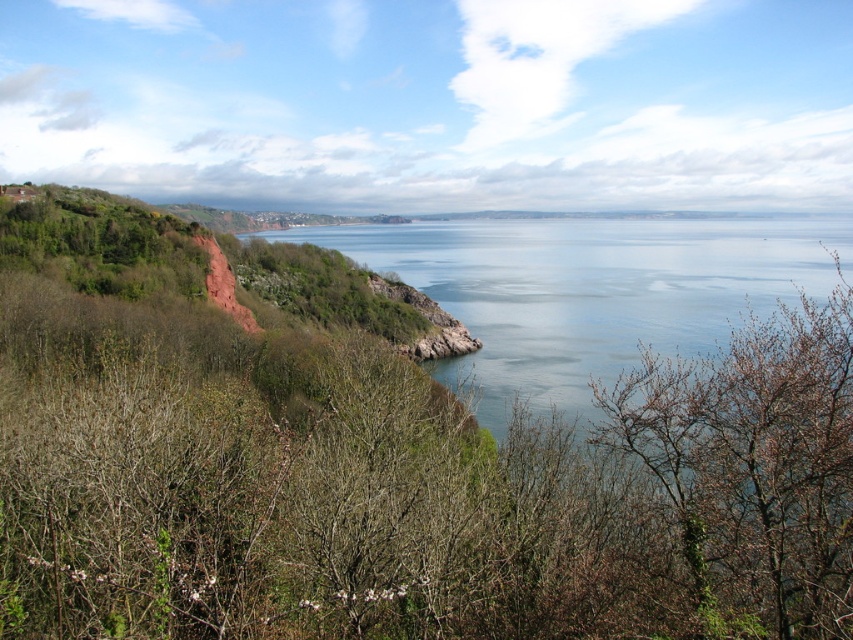
Question: Can you confirm if blue water at center is positioned below bare branches at center?

Choices:
 (A) no
 (B) yes

Answer: (A)

Question: Can you confirm if blue water at center is positioned above bare branches at center?

Choices:
 (A) yes
 (B) no

Answer: (A)

Question: Which of the following is the farthest from the observer?

Choices:
 (A) (763, 324)
 (B) (575, 221)

Answer: (B)

Question: Considering the relative positions of blue water at center and bare branches at center in the image provided, where is blue water at center located with respect to bare branches at center?

Choices:
 (A) right
 (B) left

Answer: (A)

Question: Which object appears farthest from the camera in this image?

Choices:
 (A) blue water at center
 (B) bare branches at center

Answer: (A)